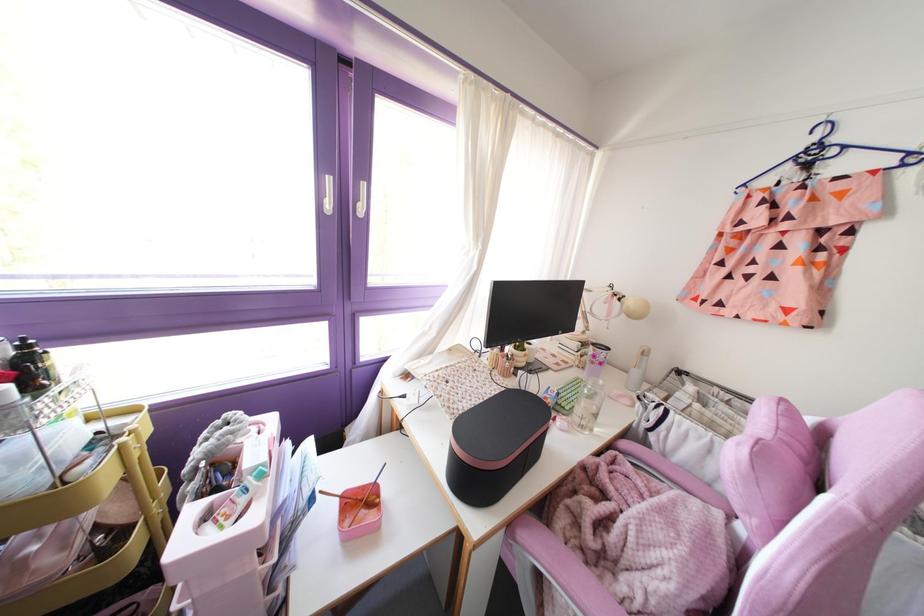
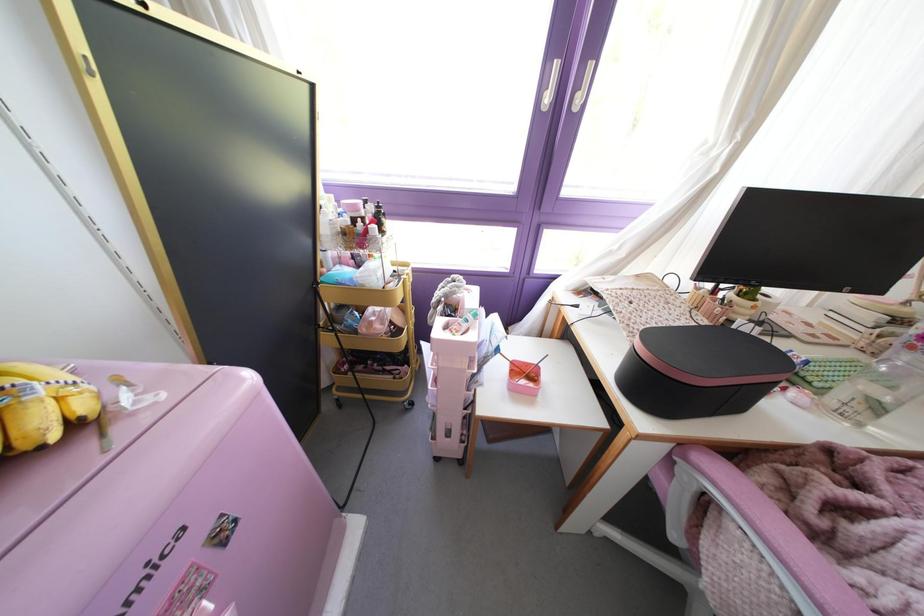
Based on the continuous images, in which direction is the camera rotating?

The rotation direction of the camera is left-down.